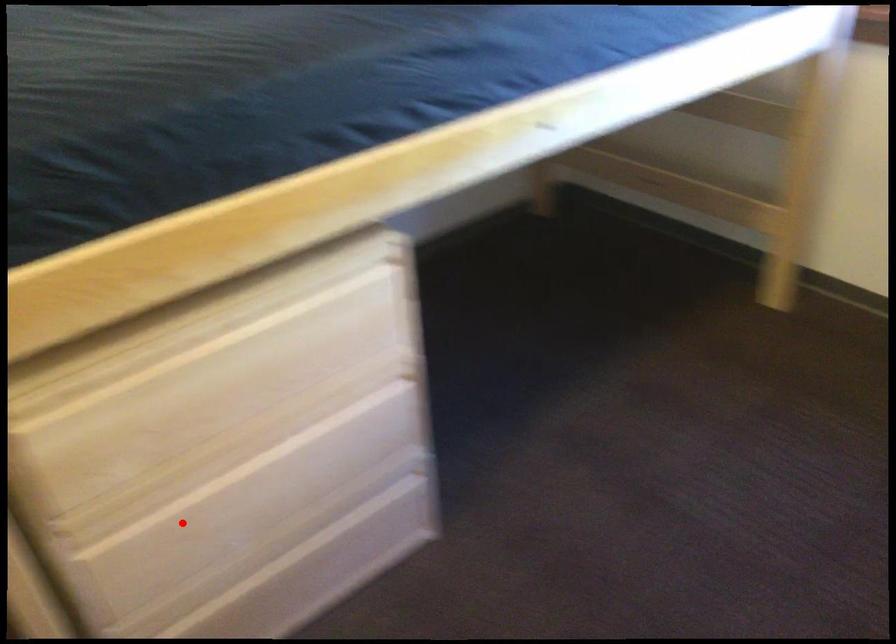
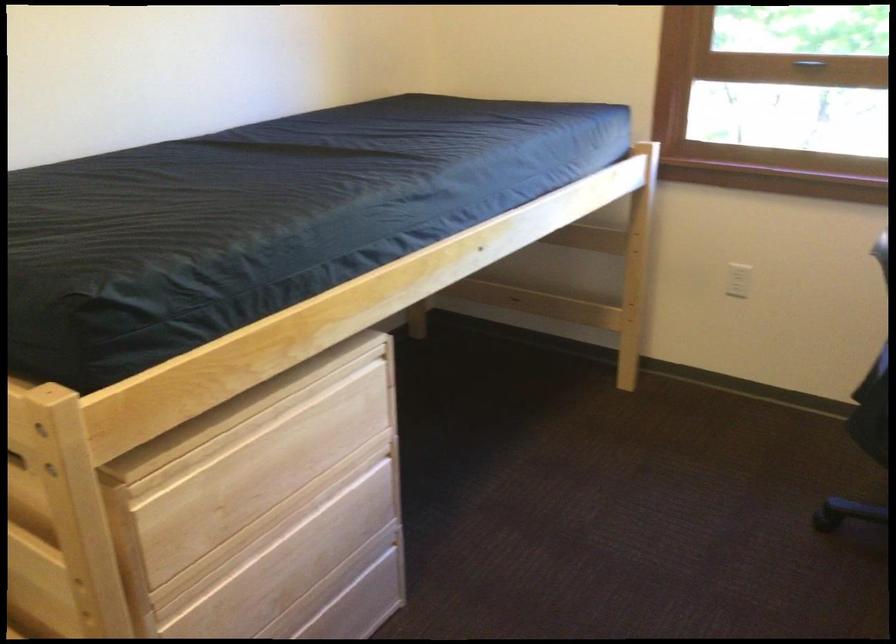
The point at the highlighted location is marked in the first image. Where is the corresponding point in the second image?

(230, 601)